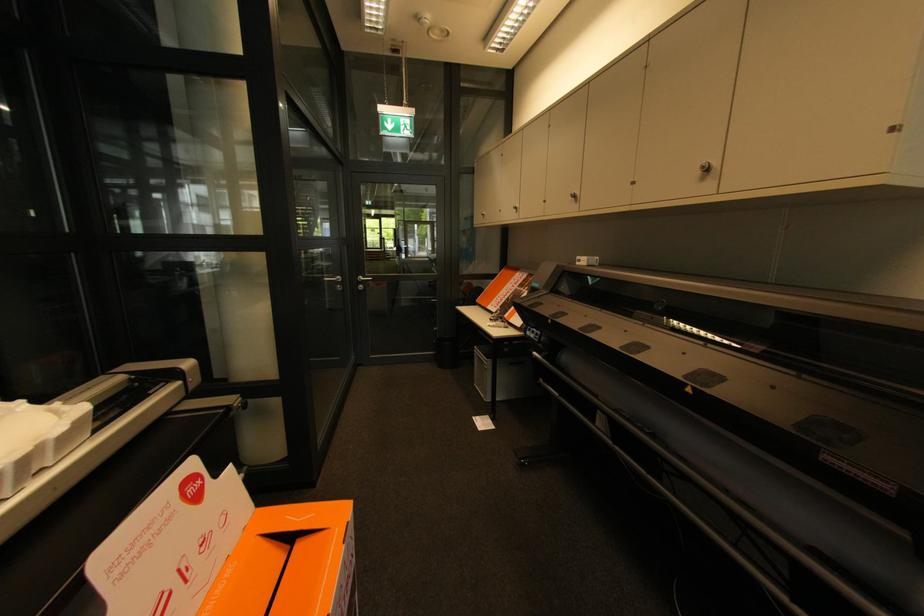
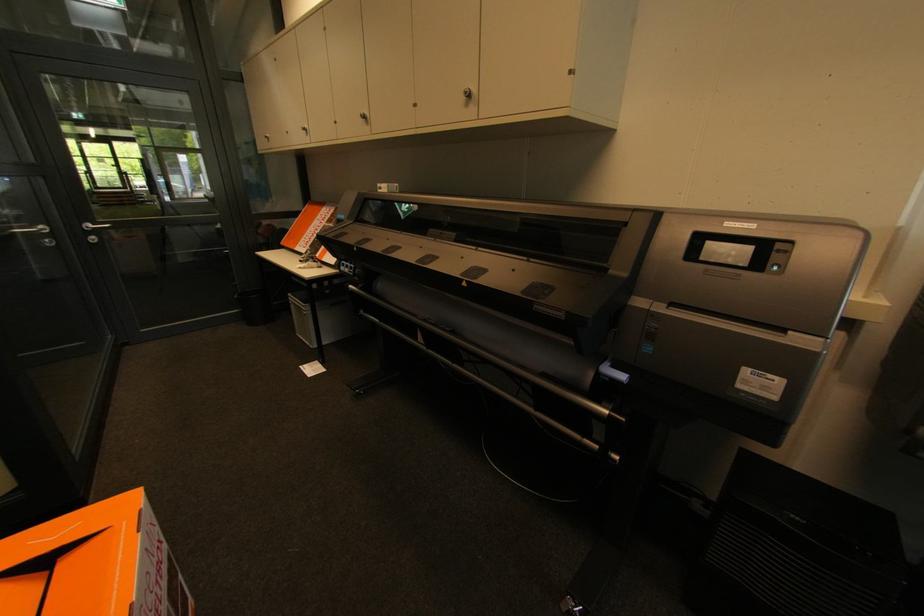
Question: The camera is either moving clockwise (left) or counter-clockwise (right) around the object. The first image is from the beginning of the video and the second image is from the end. Is the camera moving left or right when shooting the video?

Choices:
 (A) Left
 (B) Right

Answer: (A)